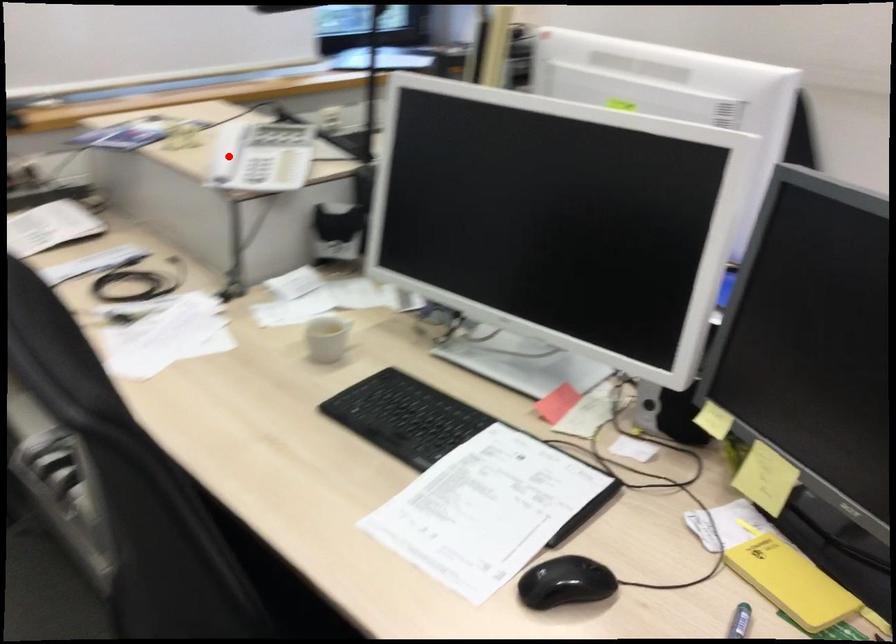
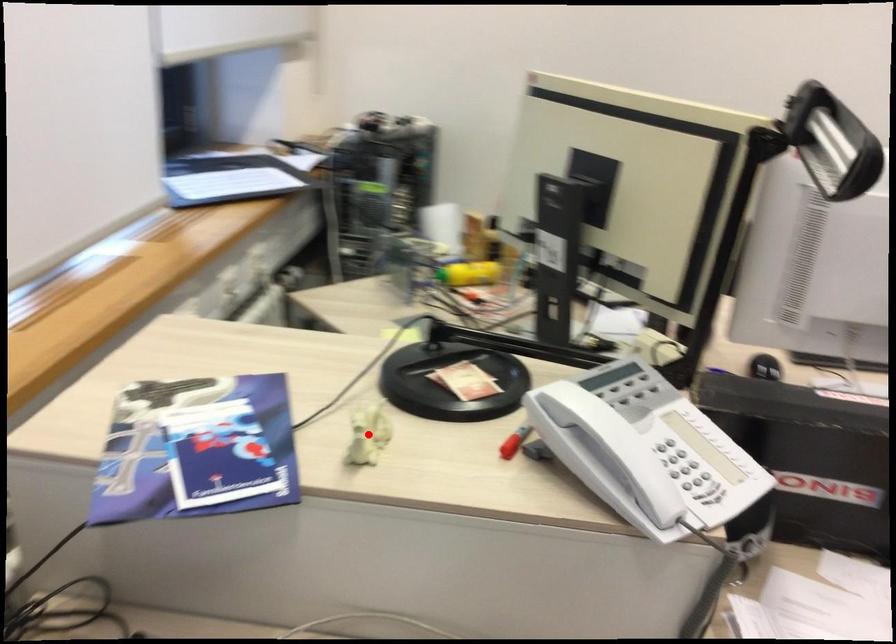
I am providing you with two images of the same scene from different viewpoints. A red point is marked on the first image and another point is marked on the second image. Does the point marked in image1 correspond to the same location as the one in image2?

No